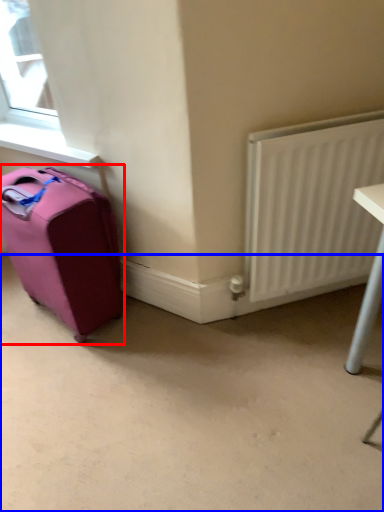
Question: Which object appears closest to the camera in this image, luggage and bags (highlighted by a red box) or concrete (highlighted by a blue box)?

Choices:
 (A) luggage and bags
 (B) concrete

Answer: (B)